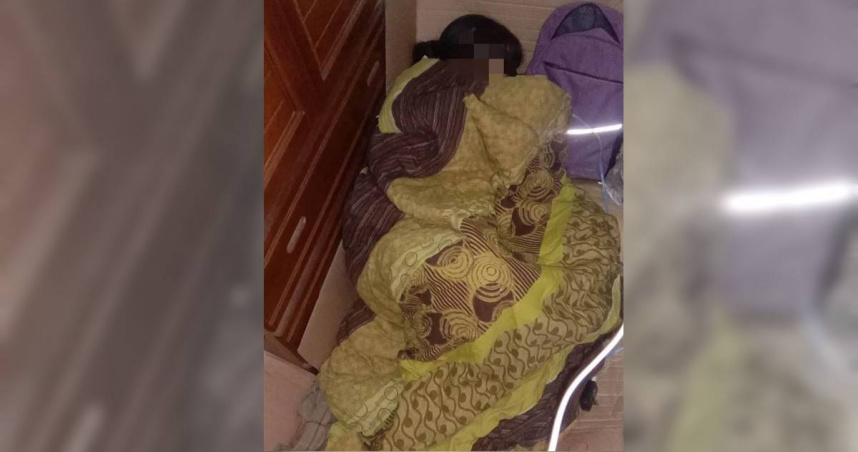
The image size is (858, 452). Identify the location of pillow. (395, 87).